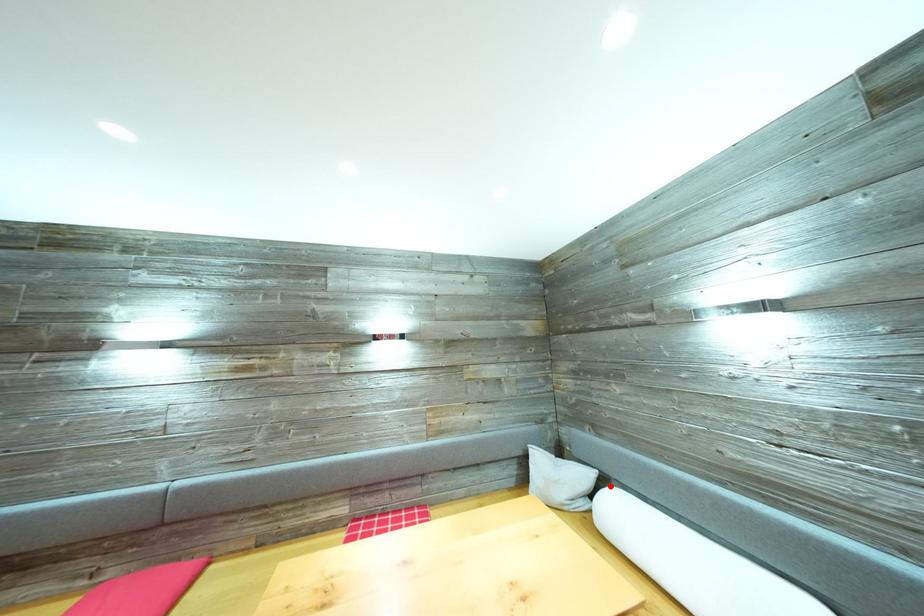
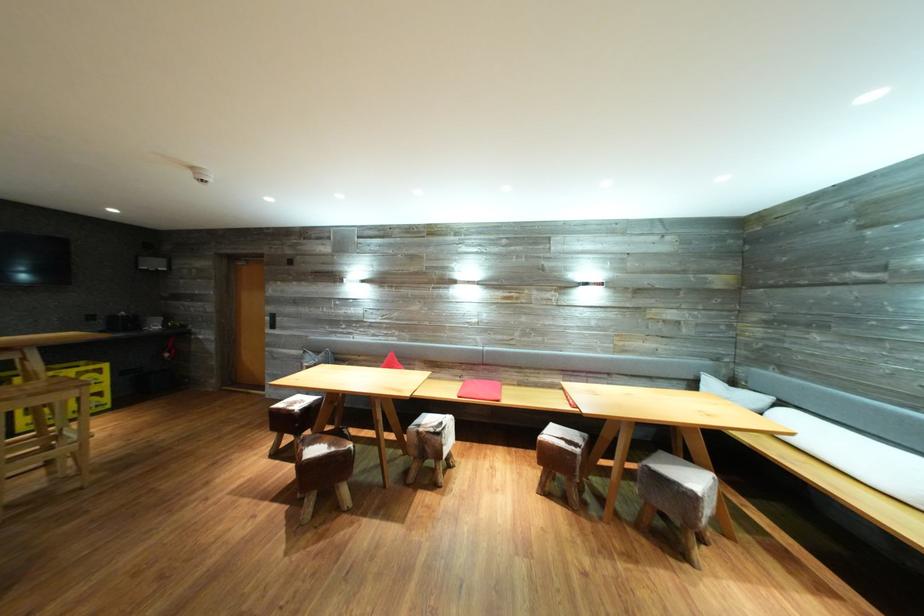
Question: I am providing you with two images of the same scene from different viewpoints. A red point is marked on the first image. Is the red point's position out of view in image 2?

Choices:
 (A) Yes
 (B) No

Answer: (A)